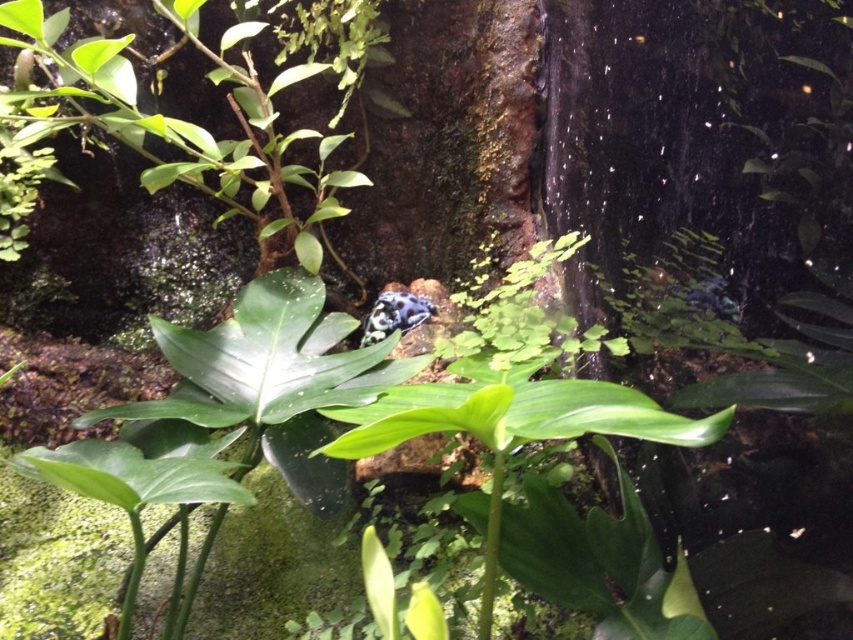
Question: Is green matte leaf at center-left positioned in front of green matte leaf at center?

Choices:
 (A) no
 (B) yes

Answer: (A)

Question: Which object is positioned farthest from the green matte leaf at center-left?

Choices:
 (A) speckled blue frog at center
 (B) green matte leaf at center

Answer: (A)

Question: From the image, what is the correct spatial relationship of green matte leaf at center in relation to speckled blue frog at center?

Choices:
 (A) left
 (B) right

Answer: (B)

Question: Which point appears farthest from the camera in this image?

Choices:
 (A) (140, 468)
 (B) (368, 320)
 (C) (500, 413)

Answer: (B)

Question: Which point is farther to the camera?

Choices:
 (A) green matte leaf at center-left
 (B) speckled blue frog at center

Answer: (B)

Question: Can you confirm if green matte leaf at center-left is positioned to the left of speckled blue frog at center?

Choices:
 (A) no
 (B) yes

Answer: (B)